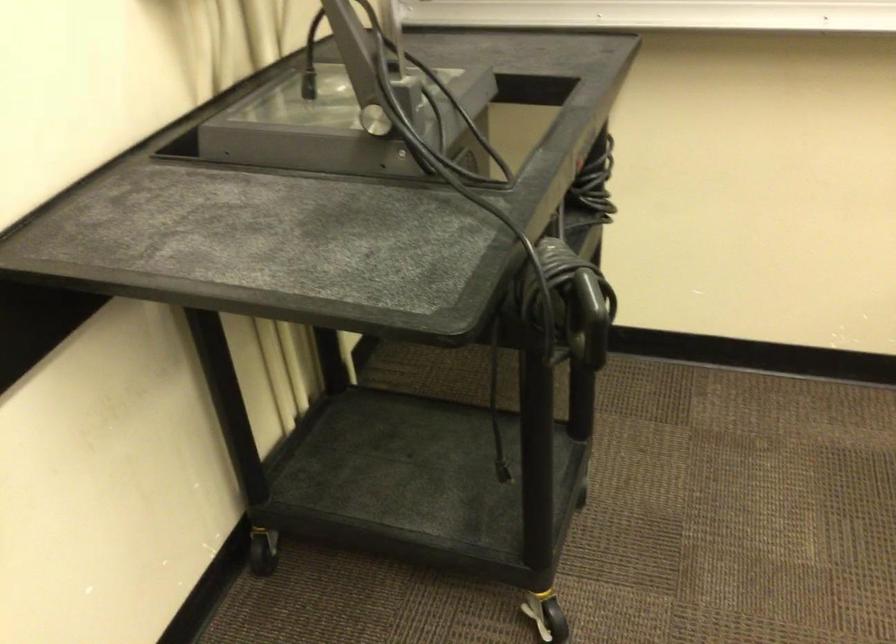
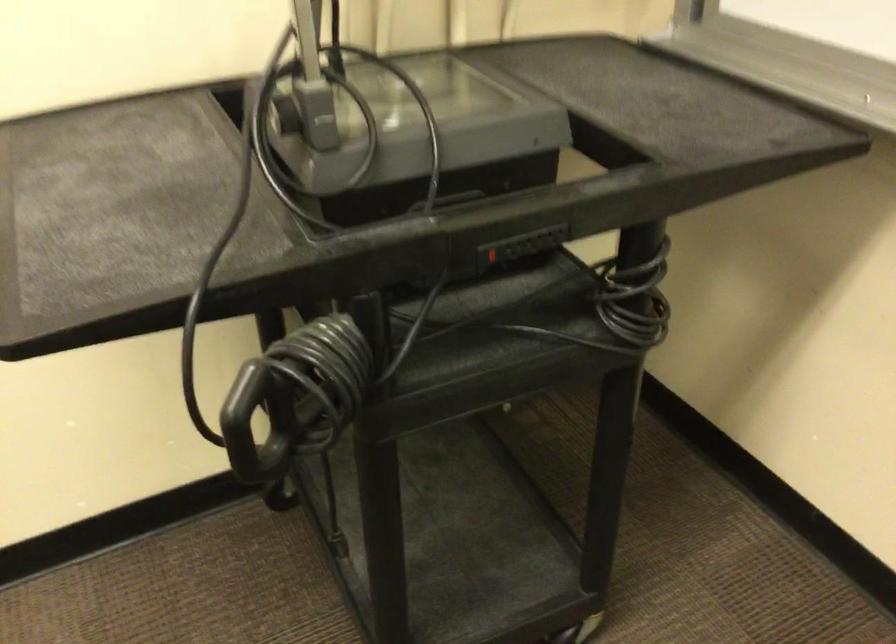
Find the pixel in the second image that matches (x=581, y=166) in the first image.

(490, 254)